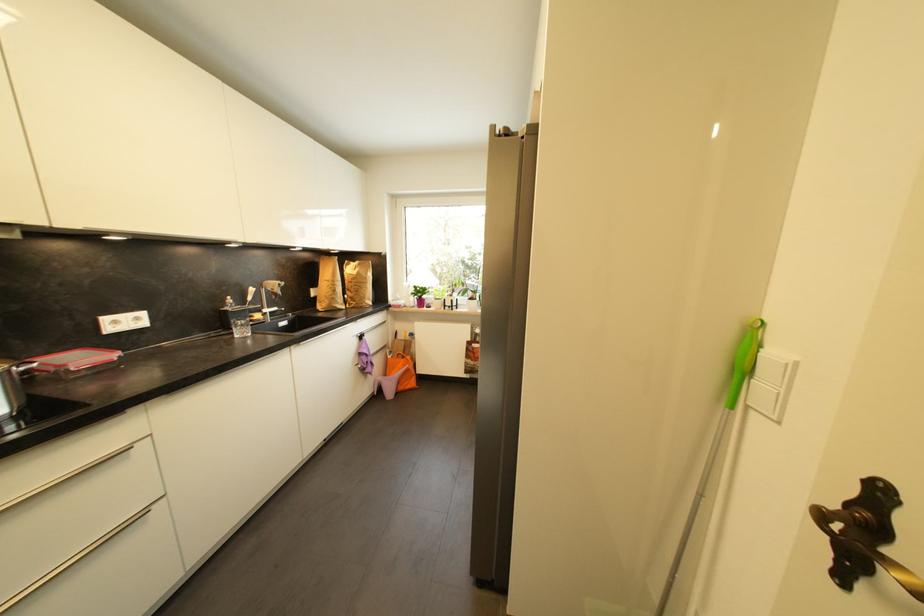
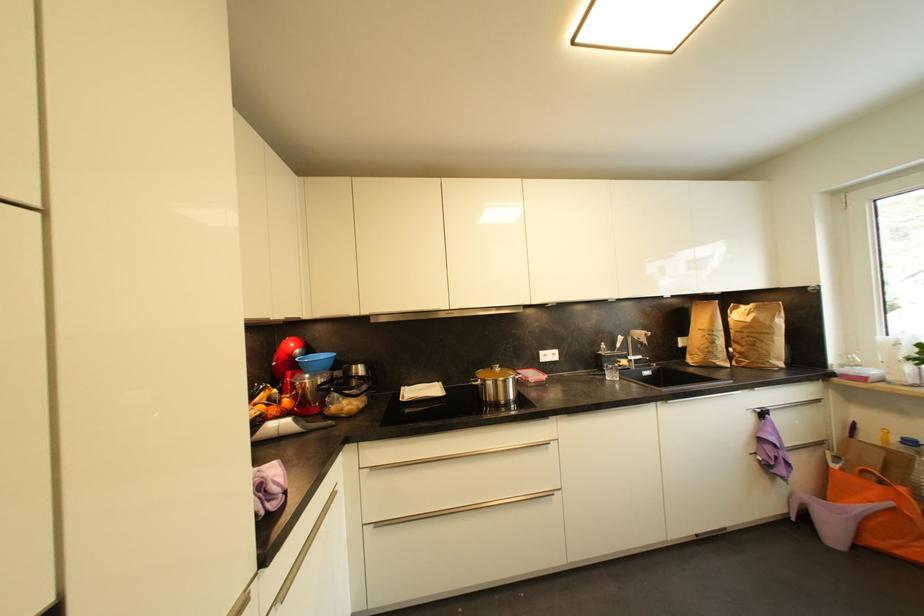
The point at (x=339, y=293) is marked in the first image. Where is the corresponding point in the second image?

(718, 345)